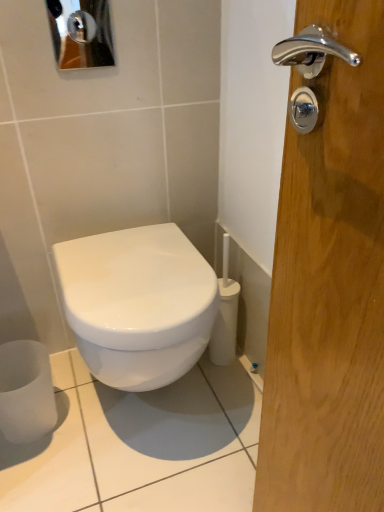
Question: From the image's perspective, would you say white glossy toilet at center is positioned over satin white toilet paper at lower left?

Choices:
 (A) yes
 (B) no

Answer: (A)

Question: Is white glossy toilet at center aimed at satin white toilet paper at lower left?

Choices:
 (A) yes
 (B) no

Answer: (B)

Question: Is white glossy toilet at center positioned beyond the bounds of satin white toilet paper at lower left?

Choices:
 (A) no
 (B) yes

Answer: (B)

Question: Does white glossy toilet at center come behind satin white toilet paper at lower left?

Choices:
 (A) yes
 (B) no

Answer: (B)

Question: From a real-world perspective, is white glossy toilet at center physically below satin white toilet paper at lower left?

Choices:
 (A) yes
 (B) no

Answer: (B)

Question: Can you confirm if white glossy toilet at center is shorter than satin white toilet paper at lower left?

Choices:
 (A) yes
 (B) no

Answer: (B)

Question: Are satin white toilet paper at lower left and white glossy toilet at center making contact?

Choices:
 (A) yes
 (B) no

Answer: (B)

Question: Is satin white toilet paper at lower left bigger than white glossy toilet at center?

Choices:
 (A) no
 (B) yes

Answer: (A)

Question: Does satin white toilet paper at lower left lie behind white glossy toilet at center?

Choices:
 (A) yes
 (B) no

Answer: (A)

Question: Is satin white toilet paper at lower left facing towards white glossy toilet at center?

Choices:
 (A) yes
 (B) no

Answer: (B)

Question: Is satin white toilet paper at lower left to the right of white glossy toilet at center from the viewer's perspective?

Choices:
 (A) no
 (B) yes

Answer: (A)

Question: Considering the relative sizes of satin white toilet paper at lower left and white glossy toilet at center in the image provided, is satin white toilet paper at lower left thinner than white glossy toilet at center?

Choices:
 (A) no
 (B) yes

Answer: (B)

Question: Is metallic reflective mirror at upper left to the left of white glossy toilet at center from the viewer's perspective?

Choices:
 (A) yes
 (B) no

Answer: (A)